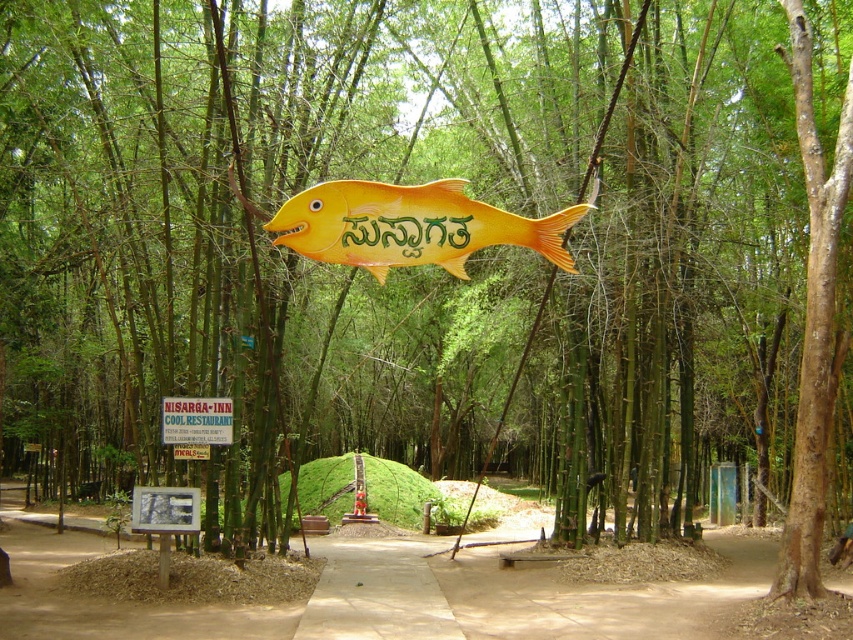
You are a park visitor who wants to take a photo of both the matte yellow fish at center and the green plastic signboard at center. Since you want both to be clearly visible in the frame, which object should you focus on to ensure proper focus and composition?

You should focus on the matte yellow fish at center because it is larger in size than the green plastic signboard at center, making it more prominent and easier to capture clearly in the photo.

You are a park visitor standing at the entrance of the bamboo grove. You see the matte yellow fish at center. Can you estimate its location in terms of coordinates?

The matte yellow fish at center is located at coordinates point (410,225).